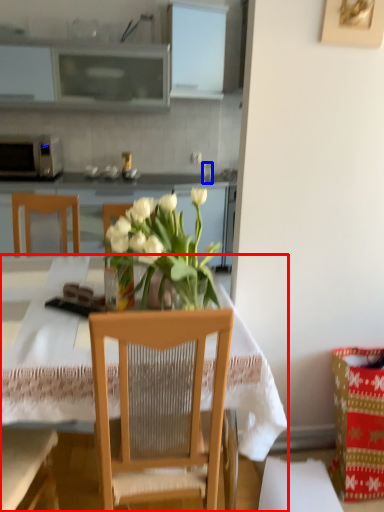
Question: Which of the following is the farthest to the observer, desk (highlighted by a red box) or coffee cup (highlighted by a blue box)?

Choices:
 (A) desk
 (B) coffee cup

Answer: (B)